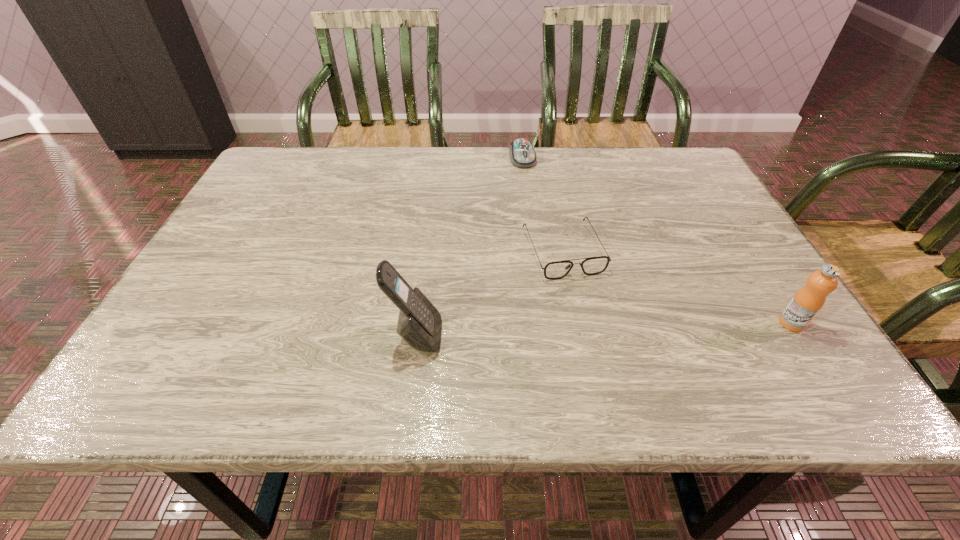
This screenshot has width=960, height=540. I want to click on vacant spot on the desktop that is between the leftmost object and the second tallest object and is positioned on the wheel side of the computer mouse, so click(583, 330).

Where is `free space on the desktop that is between the leftmost object and the rightmost object and is positioned on the front-facing side of the sunglasses`? The height and width of the screenshot is (540, 960). free space on the desktop that is between the leftmost object and the rightmost object and is positioned on the front-facing side of the sunglasses is located at coordinates (598, 329).